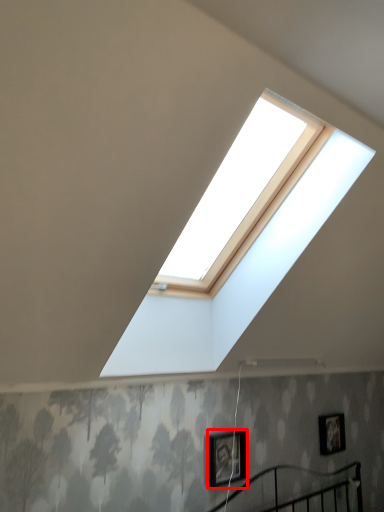
Question: From the image's perspective, where is picture frame (annotated by the red box) located in relation to picture frame in the image?

Choices:
 (A) below
 (B) above

Answer: (B)